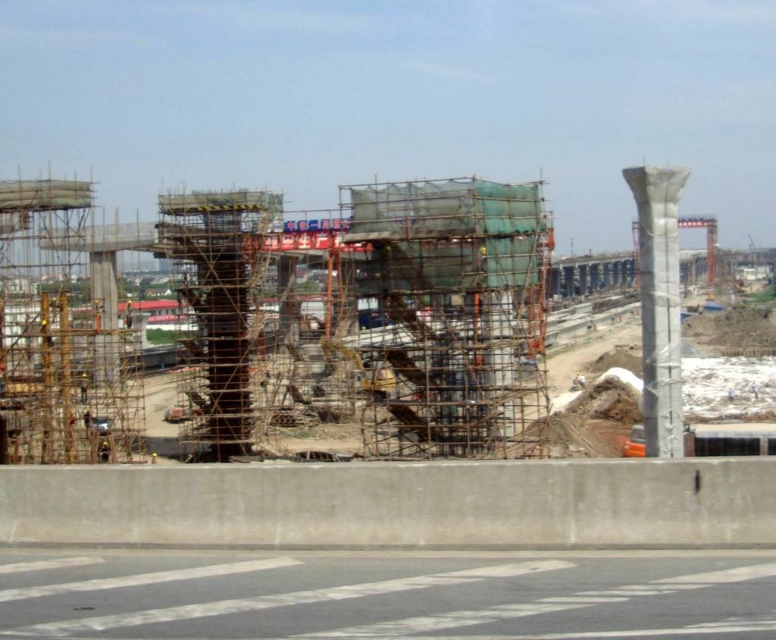
You are an inspector standing at the construction site. You need to check the white concrete pillar at right and the gray metallic crane at center. Which object should you approach first to ensure safety?

The white concrete pillar at right is closer to the viewer than the gray metallic crane at center, so you should approach the white concrete pillar at right first to ensure safety.

You are a construction worker standing at the edge of the construction site. You need to place a safety net on the white concrete pillar at right. However, there is a gray metallic crane at center overhead. Is the crane blocking the path for the safety net to be placed on the pillar?

The white concrete pillar at right is below the gray metallic crane at center, so the crane is blocking the path for placing the safety net on the pillar.

You are an engineer who needs to transport materials from the white concrete pillar at right to the gray metallic crane at center. Given that your vehicle can carry a maximum load of 5 tons, can you safely make the trip without exceeding the weight limit?

The distance between the white concrete pillar at right and the gray metallic crane at center is 41.00 meters. The question of whether the vehicle can safely transport materials without exceeding the 5 ton weight limit depends on factors like the vehicle type, road conditions, and material weight, which are not provided in the scene description. Thus, the distance alone does not determine if the weight limit will be exceeded.